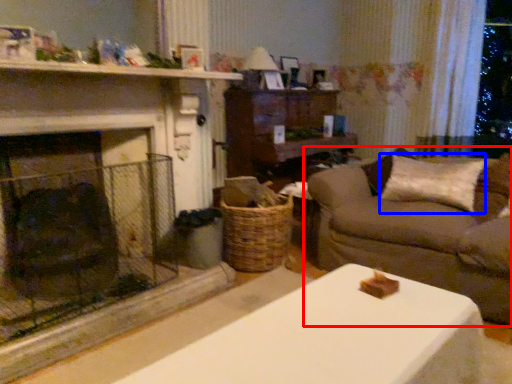
Question: Which point is closer to the camera, studio couch (highlighted by a red box) or pillow (highlighted by a blue box)?

Choices:
 (A) studio couch
 (B) pillow

Answer: (A)